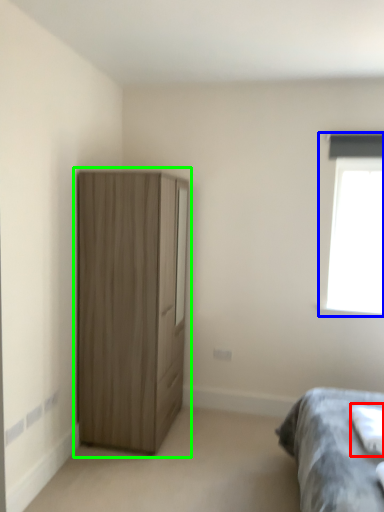
Question: Which object is positioned closest to sheet (highlighted by a red box)? Select from window (highlighted by a blue box) and cupboard (highlighted by a green box).

Choices:
 (A) window
 (B) cupboard

Answer: (A)